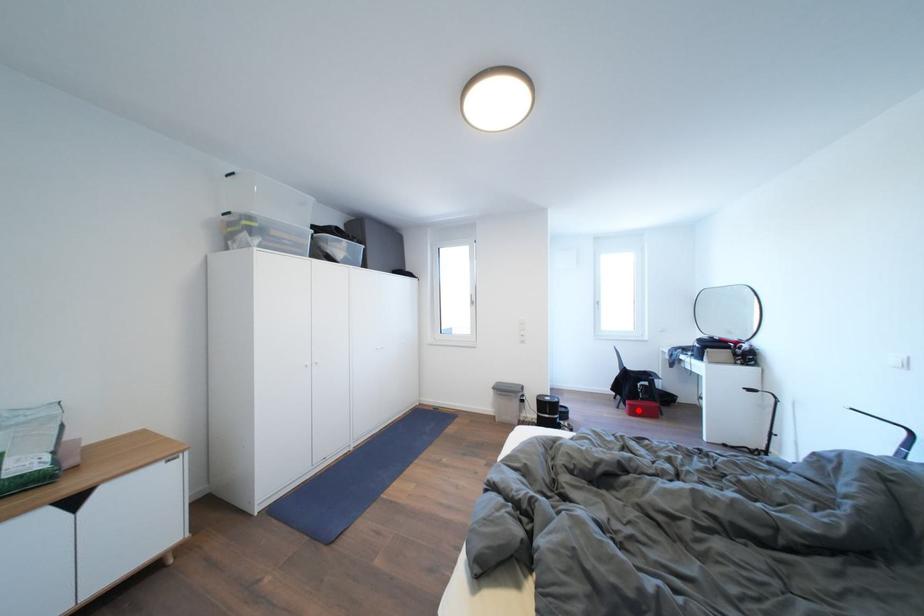
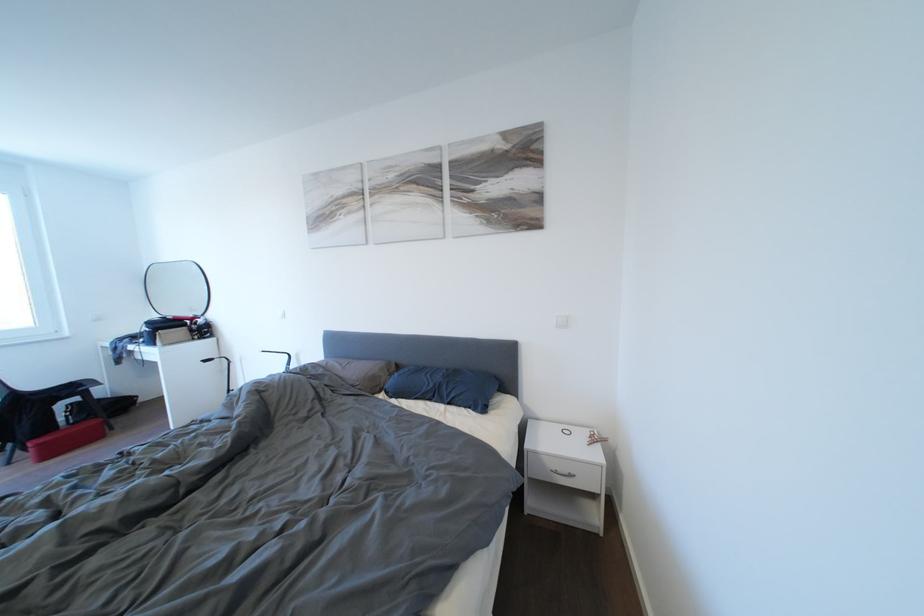
The point at the highlighted location is marked in the first image. Where is the corresponding point in the second image?

(46, 450)